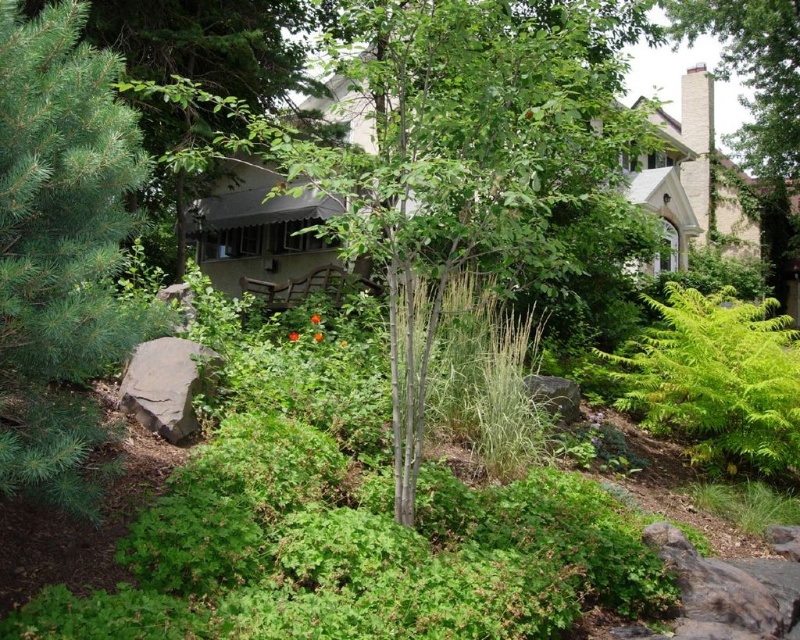
Question: Which point is closer to the camera?

Choices:
 (A) gray rough rock at lower left
 (B) green leafy bush at lower right
 (C) green smooth tree at center

Answer: (A)

Question: Estimate the real-world distances between objects in this image. Which object is closer to the gray rough stone at center-right?

Choices:
 (A) green needle-like at left
 (B) gray rough rock at lower left
 (C) green smooth tree at center

Answer: (C)

Question: Does green needle-like at left appear on the right side of green leafy bush at lower right?

Choices:
 (A) yes
 (B) no

Answer: (B)

Question: Can you confirm if green smooth tree at center is positioned above green needle-like at left?

Choices:
 (A) yes
 (B) no

Answer: (A)

Question: Estimate the real-world distances between objects in this image. Which object is farther from the gray rough rock at lower left?

Choices:
 (A) green smooth tree at center
 (B) green needle-like at left

Answer: (A)

Question: Does green leafy bush at lower right appear on the left side of gray rough rock at lower left?

Choices:
 (A) yes
 (B) no

Answer: (B)